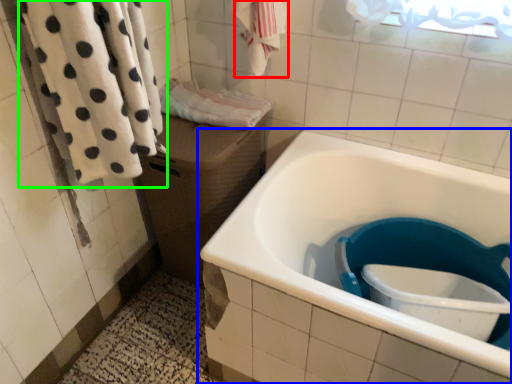
Question: Which object is the closest to the bath towel (highlighted by a red box)? Choose among these: bathtub (highlighted by a blue box) or bath towel (highlighted by a green box).

Choices:
 (A) bathtub
 (B) bath towel

Answer: (B)